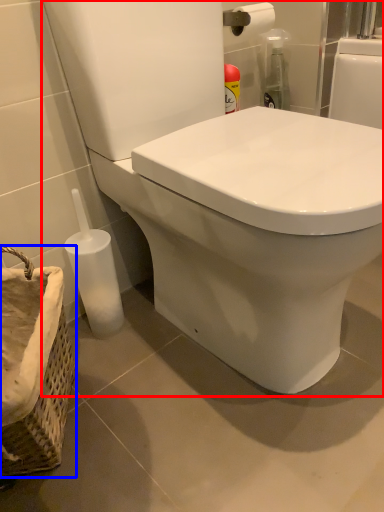
Question: Which object appears farthest to the camera in this image, toilet (highlighted by a red box) or basket container (highlighted by a blue box)?

Choices:
 (A) toilet
 (B) basket container

Answer: (B)